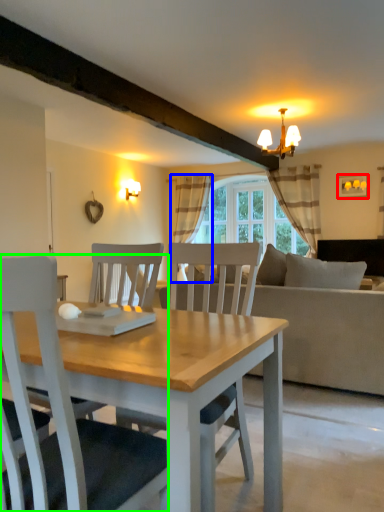
Question: Considering the real-world distances, which object is closest to picture frame (highlighted by a red box)? curtain (highlighted by a blue box) or chair (highlighted by a green box).

Choices:
 (A) curtain
 (B) chair

Answer: (A)